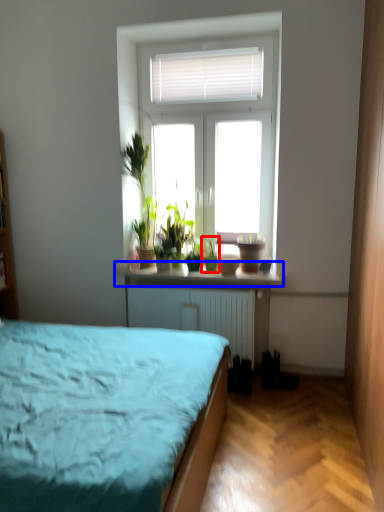
Question: Which object appears closest to the camera in this image, houseplant (highlighted by a red box) or window sill (highlighted by a blue box)?

Choices:
 (A) houseplant
 (B) window sill

Answer: (B)